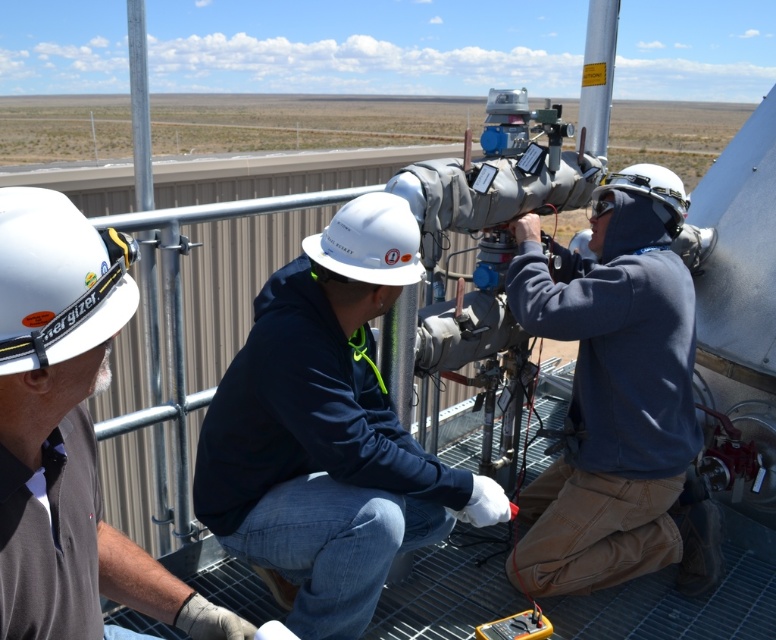
You are observing two workers from above. You see a white hard hat at upper left and a white hard hat at center. Which worker is standing higher in elevation?

The white hard hat at center is higher in elevation than the white hard hat at upper left because the white hard hat at upper left is below white hard hat at center.

You are an inspector looking at the equipment. Which object is located higher up in the image, the white hard hat at upper left or the gray metallic telescope at center?

The gray metallic telescope at center is higher up because the white hard hat at upper left is below it.